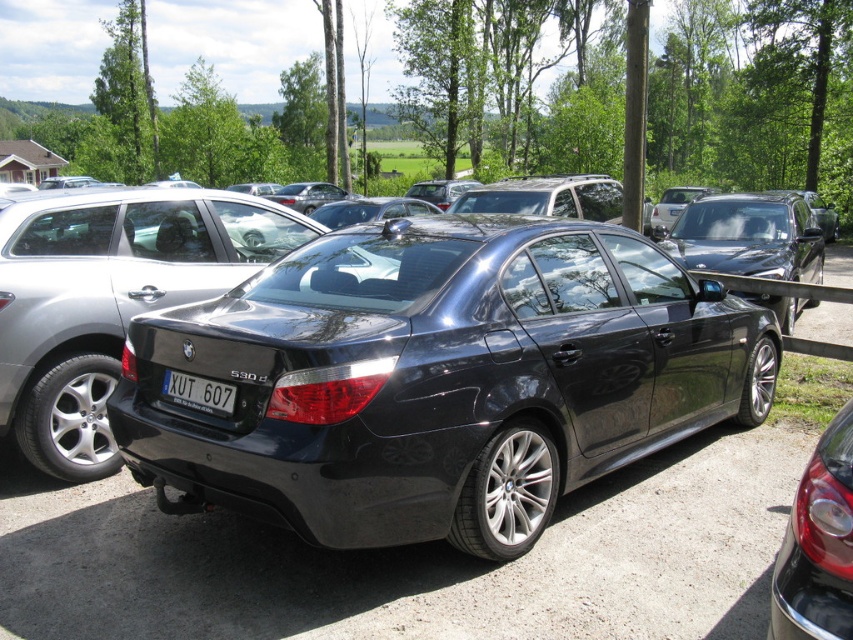
Looking at this image, you are a delivery person with a cart that is 3 meters wide. You need to move from the left side of the parking lot to the right side. There are two glossy black vehicles in the way. Can you pass between the glossy black car at center and the glossy black sedan at center?

The glossy black car at center and glossy black sedan at center are 7.70 meters apart from each other. Since your cart is only 3 meters wide, you can easily pass between them as the distance between the two vehicles is much wider than your cart.

You are standing in the parking lot and want to locate two points marked in the image. The first point is at coordinates point (670,241) and the second at point (224,404). Which point is closer to you?

Point (670,241) is closer to you because it is further to the viewer than point (224,404).